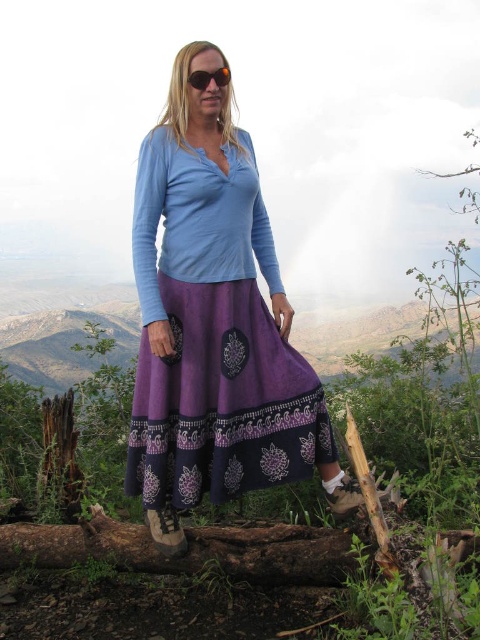
Question: Is purple cotton skirt at center further to the viewer compared to black plastic sunglasses at center?

Choices:
 (A) no
 (B) yes

Answer: (A)

Question: Considering the relative positions of purple cotton skirt at center and black plastic sunglasses at center in the image provided, where is purple cotton skirt at center located with respect to black plastic sunglasses at center?

Choices:
 (A) below
 (B) above

Answer: (A)

Question: Which of the following is the farthest from the observer?

Choices:
 (A) brown rough log at lower center
 (B) purple cotton skirt at center
 (C) black plastic sunglasses at center

Answer: (C)

Question: Is purple cotton skirt at center to the right of brown rough log at lower center from the viewer's perspective?

Choices:
 (A) yes
 (B) no

Answer: (A)

Question: Among these objects, which one is farthest from the camera?

Choices:
 (A) brown rough log at lower center
 (B) purple cotton skirt at center
 (C) black plastic sunglasses at center

Answer: (C)

Question: Which point is farther to the camera?

Choices:
 (A) (204, 76)
 (B) (227, 419)
 (C) (197, 554)

Answer: (C)